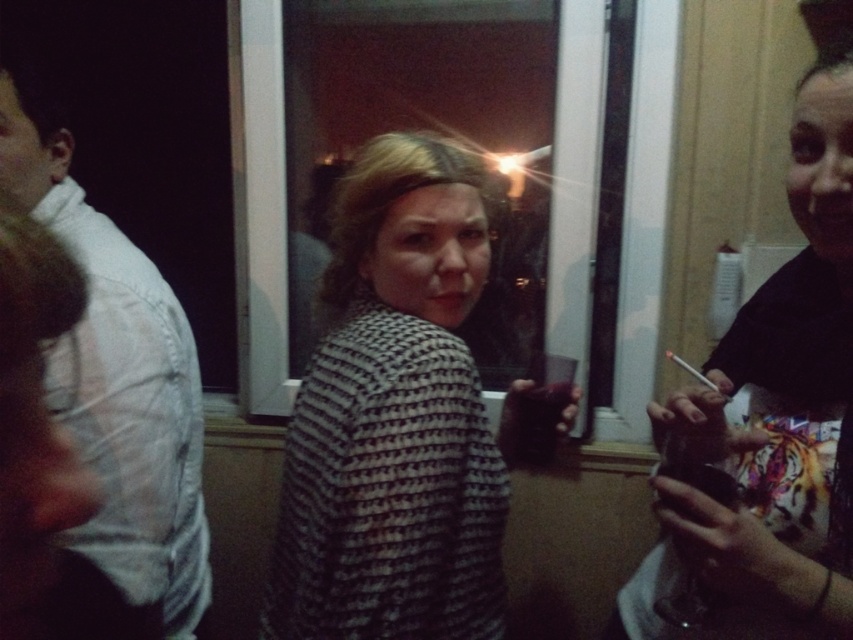
What is the color of the shirt at the point specified by the coordinates (x=770, y=422)?

The point at coordinates (x=770, y=422) is on a black matte shirt at right.

You are at a party and want to find the shortest person between the black matte shirt at right and the white cotton shirt at left. Which one should you look for?

The black matte shirt at right is shorter than the white cotton shirt at left, so you should look for the black matte shirt at right.

You are organizing a photo album and want to ensure all items are labeled correctly. Given the image described, which object is wider between the white cotton shirt at left and the matte white cigarette at center?

The white cotton shirt at left is wider than the matte white cigarette at center.